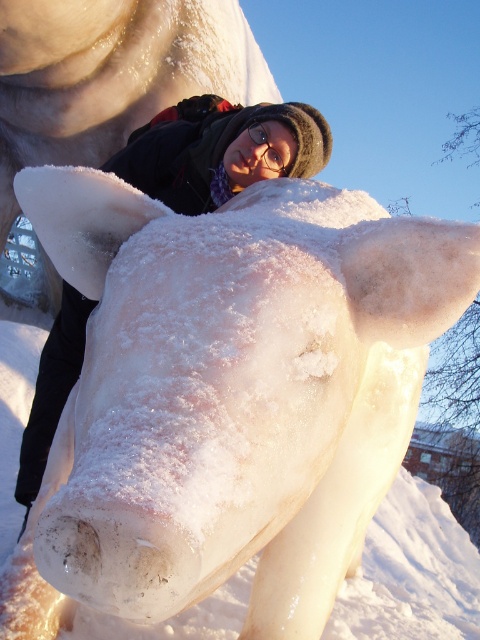
You are standing in front of the icy white sculpture at center and the matte black jacket at center. Which object is positioned to the right?

The icy white sculpture at center is positioned to the right of the matte black jacket at center.

You are standing in front of the ice sculpture cow and want to take a photo of the matte black jacket at center. Where should you position your camera to capture the jacket in the frame?

To capture the matte black jacket at center, position your camera at the coordinates corresponding to the point where the jacket is located, which is at 2D location point (217, 150).

You are a photographer trying to capture the ice sculpture. You notice the matte black jacket at center and the transparent plastic goggles at center. Which object is positioned higher in the image?

The matte black jacket at center is above the transparent plastic goggles at center, so it is positioned higher in the image.